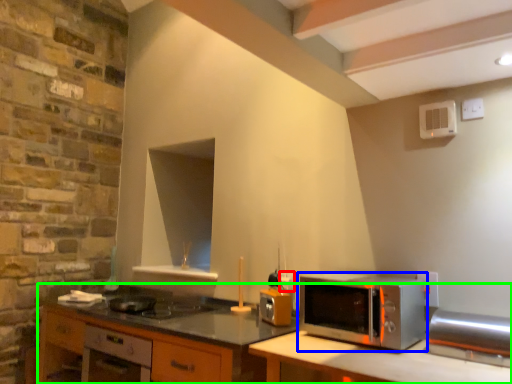
Question: Based on their relative distances, which object is farther from electric outlet (highlighted by a red box)? Choose from microwave oven (highlighted by a blue box) and cabinetry (highlighted by a green box).

Choices:
 (A) microwave oven
 (B) cabinetry

Answer: (B)